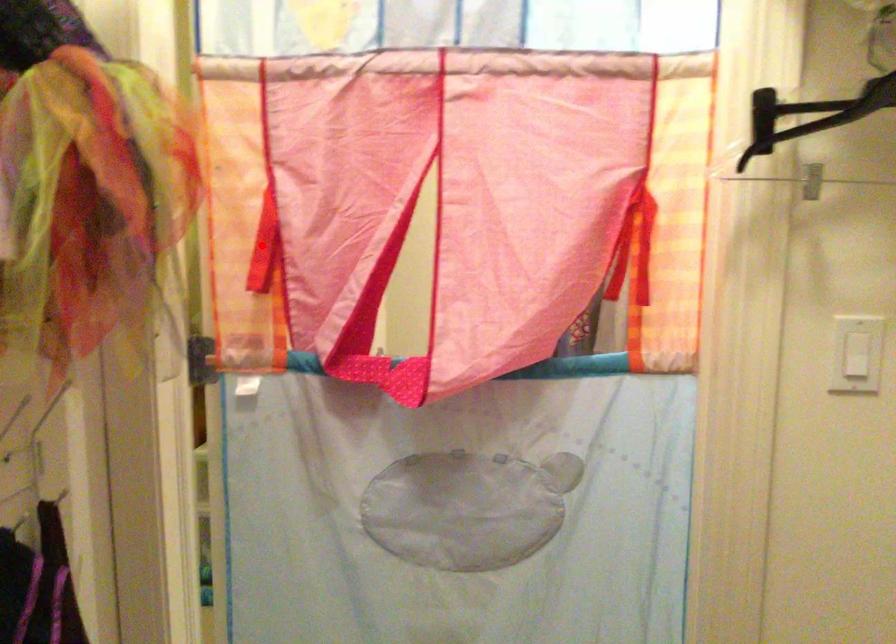
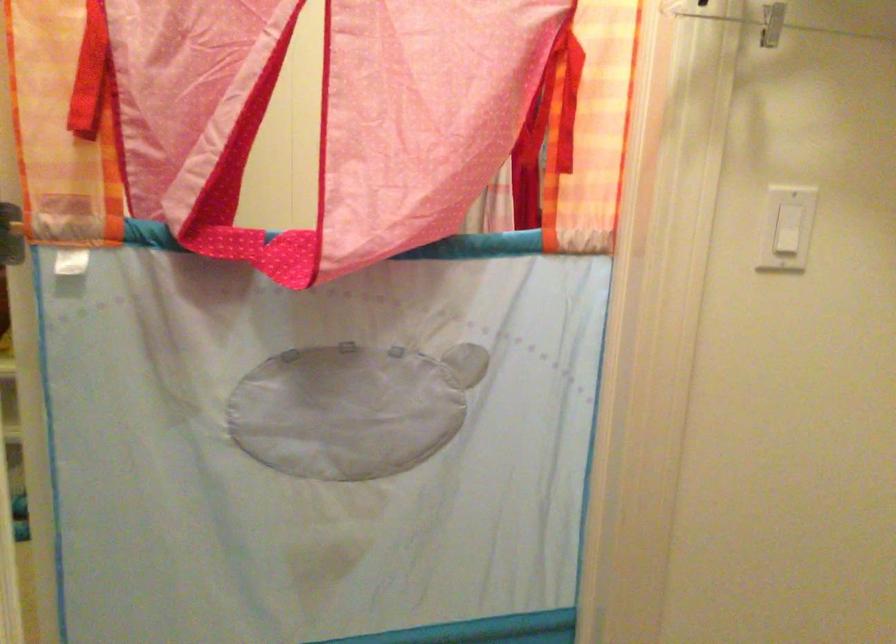
Question: I am providing you with two images of the same scene from different viewpoints. A red point is shown in image1. For the corresponding object point in image2, is it positioned nearer or farther from the camera?

Choices:
 (A) Nearer
 (B) Farther

Answer: (A)